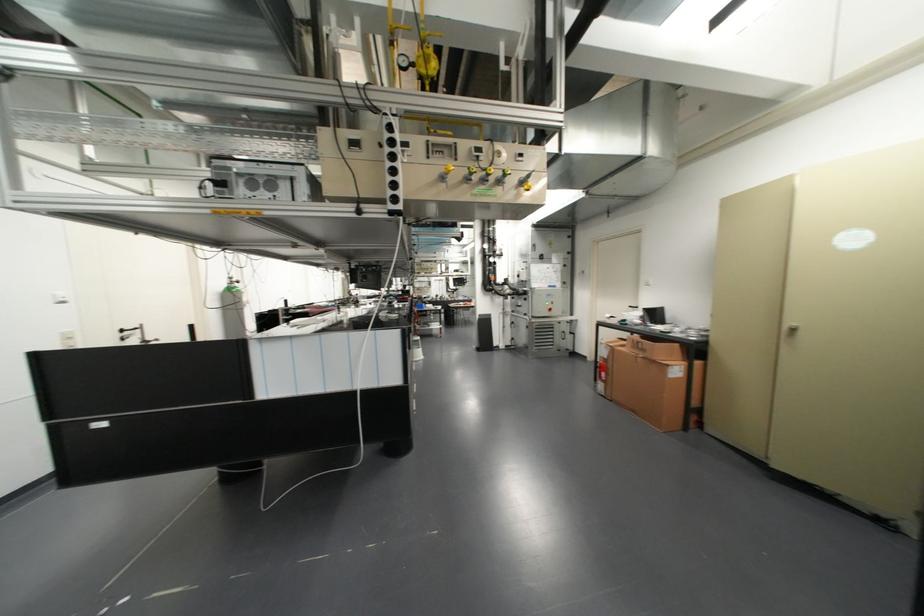
Find where to lift the red fire extinguisher. Please return your answer as a coordinate pair (x, y).

(602, 371)